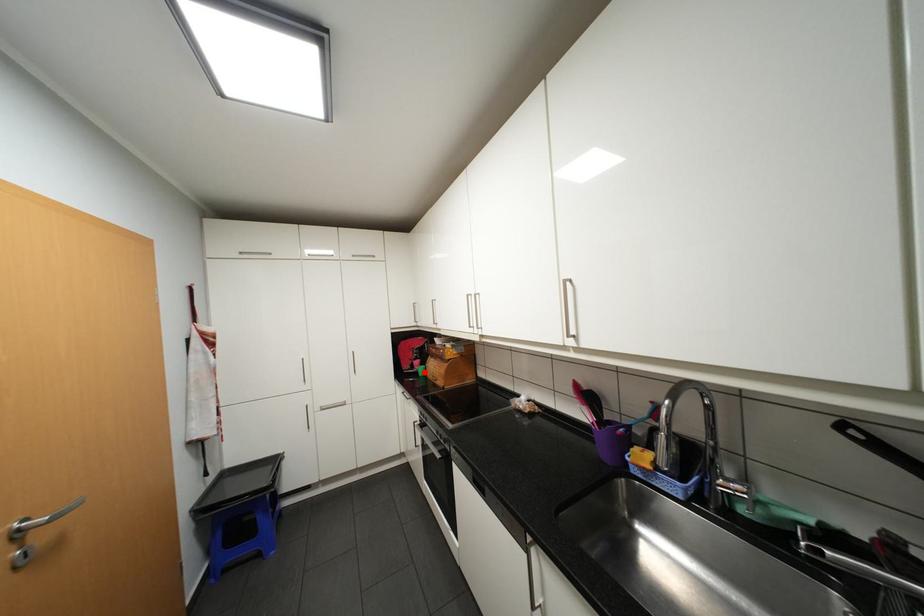
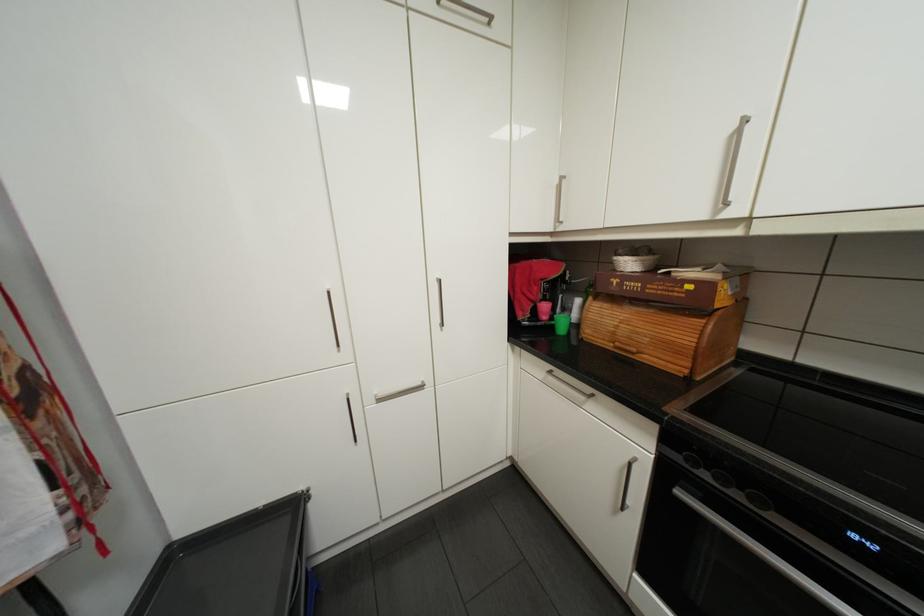
Where in the second image is the point corresponding to the highlighted location from the first image?

(557, 328)